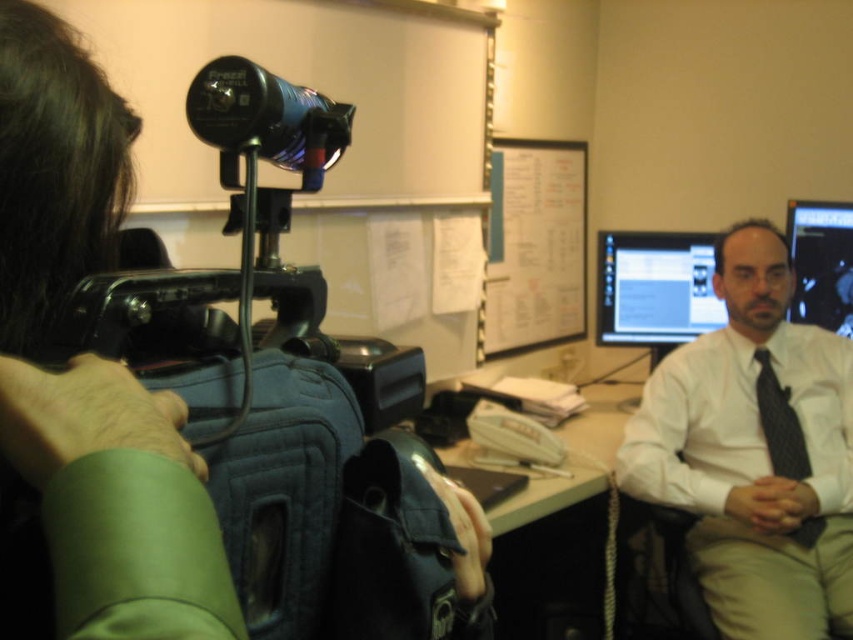
Looking at this image, you are a photographer setting up for a portrait session. You notice the white shirt at center and the white glossy table at center in the scene. Which object is closer to you, the photographer?

The white shirt at center is closer to you because it is in front of the white glossy table at center.

You are a photographer standing at the position of the camera operator. You want to hand a microphone to the person wearing the white shirt at center. Can you reach them without moving from your current position?

The white shirt at center and the viewer are 1.65 meters apart. The average human arm length is about 0.7 meters, so you cannot reach them without moving from your current position.